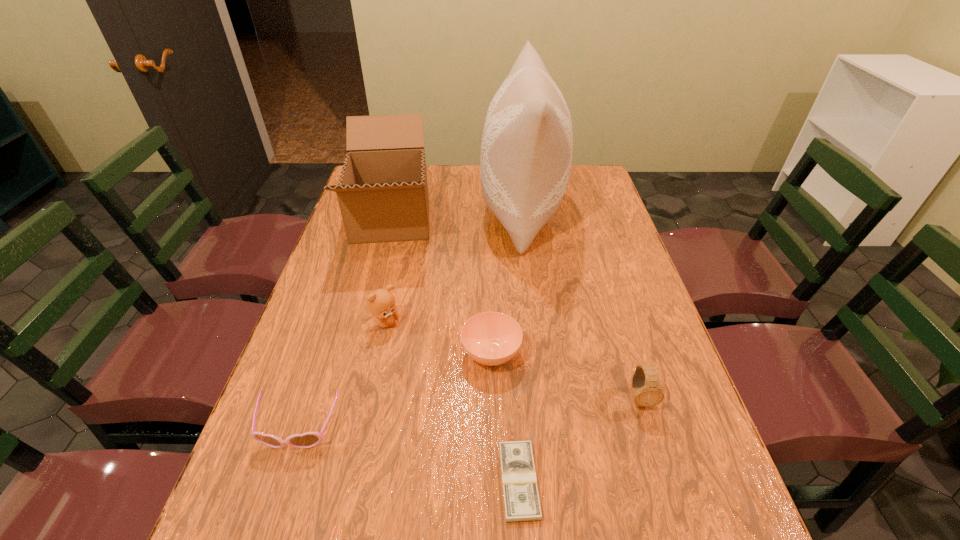
I want to click on blank space located 0.060m on the back of the box, so click(x=403, y=175).

This screenshot has width=960, height=540. I want to click on free space located 0.080m on the face of the teddy bear, so click(430, 323).

In order to click on free region located on the face of the rightmost object in this screenshot , I will do 669,495.

Find the location of a particular element. Image resolution: width=960 pixels, height=540 pixels. vacant region located on the right of the soup bowl is located at coordinates (630, 353).

You are a GUI agent. You are given a task and a screenshot of the screen. Output one action in this format:
    pyautogui.click(x=<x>, y=<y>)
    Task: Click on the vacant space situated on the front-facing side of the sunglasses
    The image size is (960, 540).
    Given the screenshot: What is the action you would take?
    pyautogui.click(x=273, y=507)

At what (x,y) coordinates should I click in order to perform the action: click on free space located 0.190m on the back of the shortest object. Please return your answer as a coordinate pair (x, y). This screenshot has width=960, height=540. Looking at the image, I should click on (512, 366).

What are the coordinates of `cushion present at the far edge` in the screenshot? It's located at (527, 144).

Locate an element on the screen. The height and width of the screenshot is (540, 960). box that is at the far edge is located at coordinates (382, 192).

I want to click on box located at the left edge, so click(x=382, y=192).

At what (x,y) coordinates should I click in order to perform the action: click on sunglasses that is at the left edge. Please return your answer as a coordinate pair (x, y). Looking at the image, I should click on (309, 439).